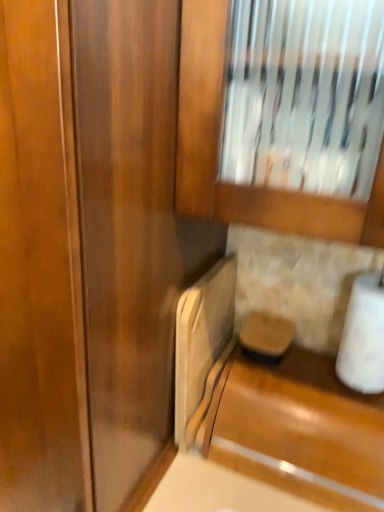
You are a GUI agent. You are given a task and a screenshot of the screen. Output one action in this format:
    pyautogui.click(x=<x>, y=<y>)
    Task: Click on the empty space that is ontop of glossy wood cabinet at lower right (from a real-world perspective)
    The image size is (384, 512).
    Given the screenshot: What is the action you would take?
    pyautogui.click(x=311, y=385)